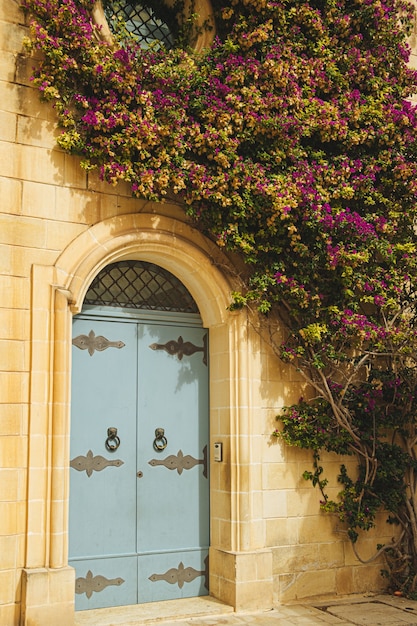
Find the location of `blue door`. blue door is located at coordinates click(109, 399), click(168, 398).